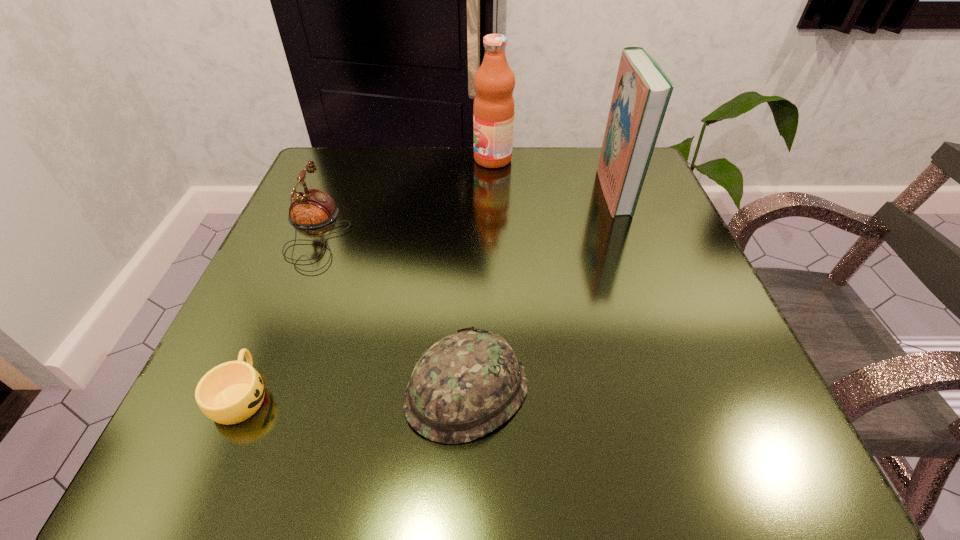
Find the location of a particular element. The image size is (960, 540). cup at the left edge is located at coordinates (231, 392).

At what (x,y) coordinates should I click in order to perform the action: click on object at the right edge. Please return your answer as a coordinate pair (x, y). Looking at the image, I should click on (642, 91).

The width and height of the screenshot is (960, 540). I want to click on object located in the far left corner section of the desktop, so click(311, 208).

The image size is (960, 540). I want to click on object situated at the near left corner, so click(x=231, y=392).

Find the location of a particular element. Image resolution: width=960 pixels, height=540 pixels. object that is at the far right corner is located at coordinates pyautogui.click(x=642, y=91).

Find the location of a particular element. free space at the far edge of the desktop is located at coordinates (501, 186).

I want to click on vacant space at the near edge of the desktop, so click(337, 423).

What are the coordinates of `vacant space at the left edge of the desktop` in the screenshot? It's located at (287, 264).

In the image, there is a desktop. Where is `vacant space at the right edge`? vacant space at the right edge is located at coordinates (706, 336).

Locate an element on the screen. free spot at the near left corner of the desktop is located at coordinates (312, 413).